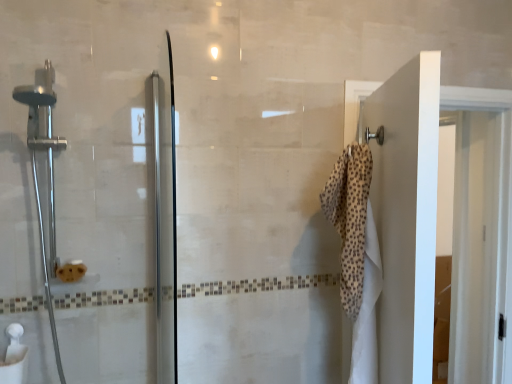
Question: From a real-world perspective, is beige dotted towel at right physically below satin chrome shower head at left?

Choices:
 (A) yes
 (B) no

Answer: (A)

Question: Is beige dotted towel at right wider than satin chrome shower head at left?

Choices:
 (A) no
 (B) yes

Answer: (A)

Question: Can you confirm if beige dotted towel at right is smaller than satin chrome shower head at left?

Choices:
 (A) no
 (B) yes

Answer: (B)

Question: Considering the relative positions of beige dotted towel at right and satin chrome shower head at left in the image provided, is beige dotted towel at right to the right of satin chrome shower head at left from the viewer's perspective?

Choices:
 (A) yes
 (B) no

Answer: (A)

Question: Considering the relative positions of beige dotted towel at right and satin chrome shower head at left in the image provided, is beige dotted towel at right to the left of satin chrome shower head at left from the viewer's perspective?

Choices:
 (A) no
 (B) yes

Answer: (A)

Question: Does beige dotted towel at right come behind satin chrome shower head at left?

Choices:
 (A) yes
 (B) no

Answer: (A)

Question: Does satin chrome shower head at left lie behind beige dotted towel at right?

Choices:
 (A) no
 (B) yes

Answer: (A)

Question: Considering the relative sizes of satin chrome shower head at left and beige dotted towel at right in the image provided, is satin chrome shower head at left wider than beige dotted towel at right?

Choices:
 (A) no
 (B) yes

Answer: (B)

Question: Can you confirm if satin chrome shower head at left is smaller than beige dotted towel at right?

Choices:
 (A) yes
 (B) no

Answer: (B)

Question: Could beige dotted towel at right be considered to be inside satin chrome shower head at left?

Choices:
 (A) no
 (B) yes

Answer: (A)

Question: Is satin chrome shower head at left aimed at beige dotted towel at right?

Choices:
 (A) no
 (B) yes

Answer: (A)

Question: From a real-world perspective, is satin chrome shower head at left located beneath beige dotted towel at right?

Choices:
 (A) yes
 (B) no

Answer: (B)

Question: Relative to satin chrome shower head at left, is beige dotted towel at right in front or behind?

Choices:
 (A) front
 (B) behind

Answer: (B)